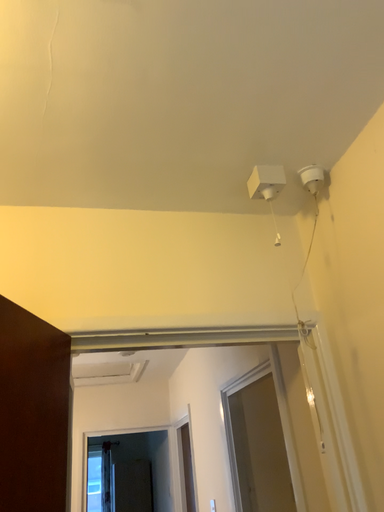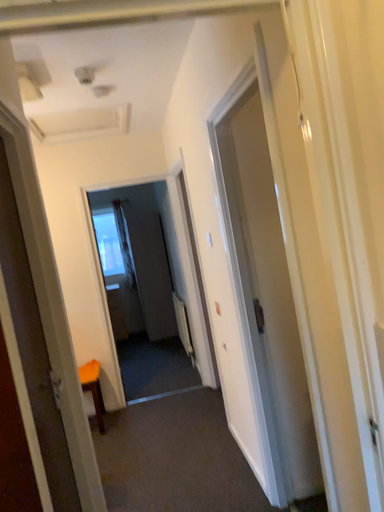
Question: How did the camera likely rotate when shooting the video?

Choices:
 (A) rotated downward
 (B) rotated upward

Answer: (A)